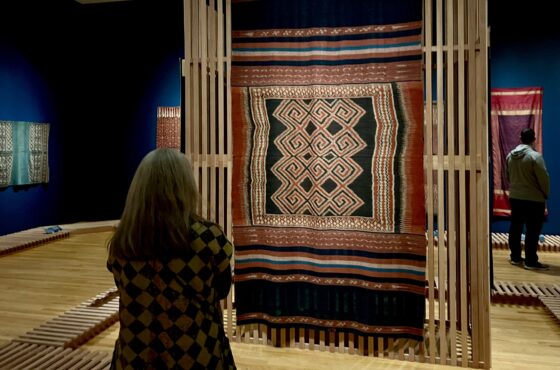
The width and height of the screenshot is (560, 370). Identify the location of woven artwork. (403, 155).